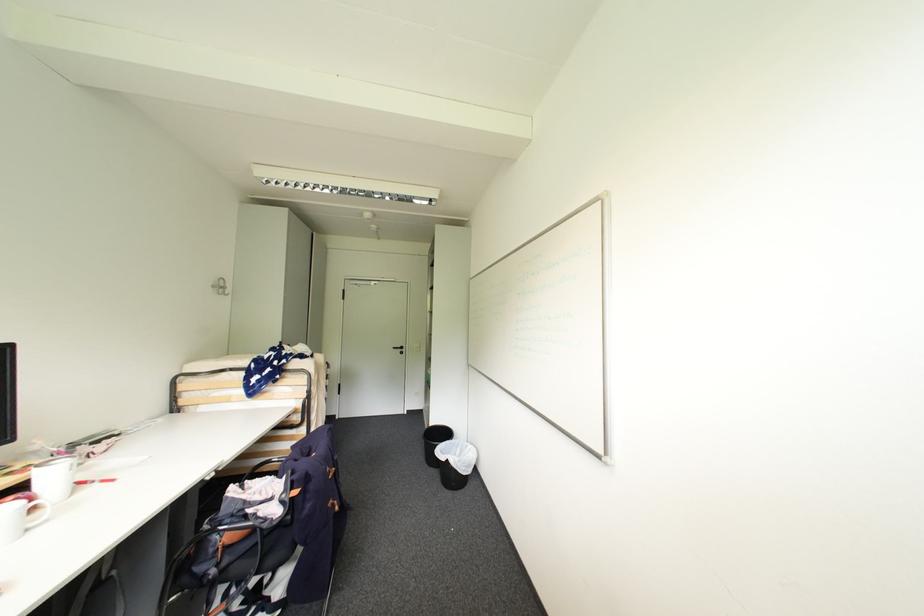
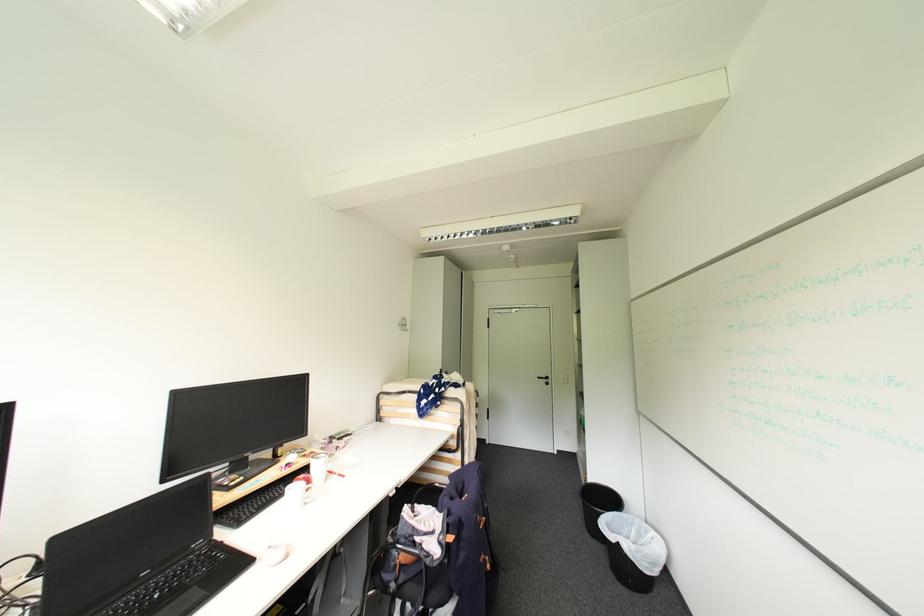
The point at (103,484) is marked in the first image. Where is the corresponding point in the second image?

(343, 477)